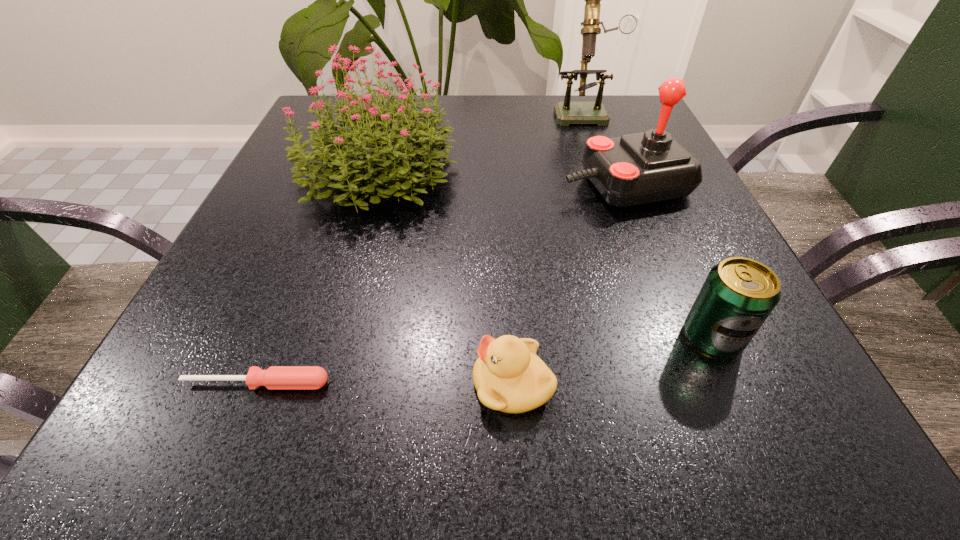
Locate an element on the screen. screwdriver that is at the left edge is located at coordinates (275, 377).

In order to click on microscope positioned at the right edge in this screenshot , I will do `click(567, 112)`.

Identify the location of joystick that is at the right edge. (641, 168).

Identify the location of beer can at the right edge. (738, 295).

You are a GUI agent. You are given a task and a screenshot of the screen. Output one action in this format:
    pyautogui.click(x=<x>, y=<y>)
    Task: Click on the object at the far left corner
    
    Given the screenshot: What is the action you would take?
    pyautogui.click(x=402, y=154)

At what (x,y) coordinates should I click in order to perform the action: click on object at the far right corner. Please return your answer as a coordinate pair (x, y). Looking at the image, I should click on click(567, 112).

You are a GUI agent. You are given a task and a screenshot of the screen. Output one action in this format:
    pyautogui.click(x=<x>, y=<y>)
    Task: Click on the vacant space at the far edge of the desktop
    The height and width of the screenshot is (540, 960).
    Given the screenshot: What is the action you would take?
    (447, 105)

Where is `vacant region at the near edge of the desktop`? vacant region at the near edge of the desktop is located at coordinates (642, 465).

This screenshot has width=960, height=540. I want to click on vacant space at the left edge of the desktop, so pyautogui.click(x=210, y=356).

Identify the location of free space at the right edge. point(675,231).